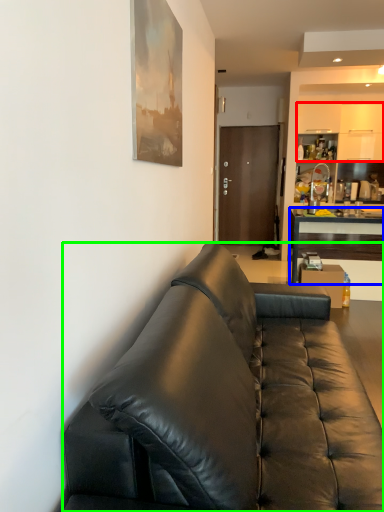
Question: Considering the real-world distances, which object is closest to cabinetry (highlighted by a red box)? desk (highlighted by a blue box) or studio couch (highlighted by a green box).

Choices:
 (A) desk
 (B) studio couch

Answer: (A)